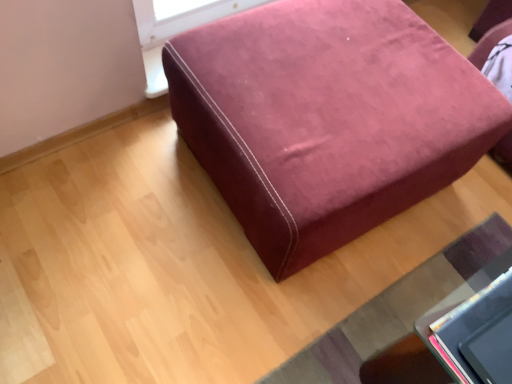
You are a GUI agent. You are given a task and a screenshot of the screen. Output one action in this format:
    pyautogui.click(x=<x>, y=<y>)
    Task: Click on the free location above velvet-like burgundy ottoman at center (from a real-world perspective)
    This screenshot has width=512, height=384.
    Given the screenshot: What is the action you would take?
    point(339,81)